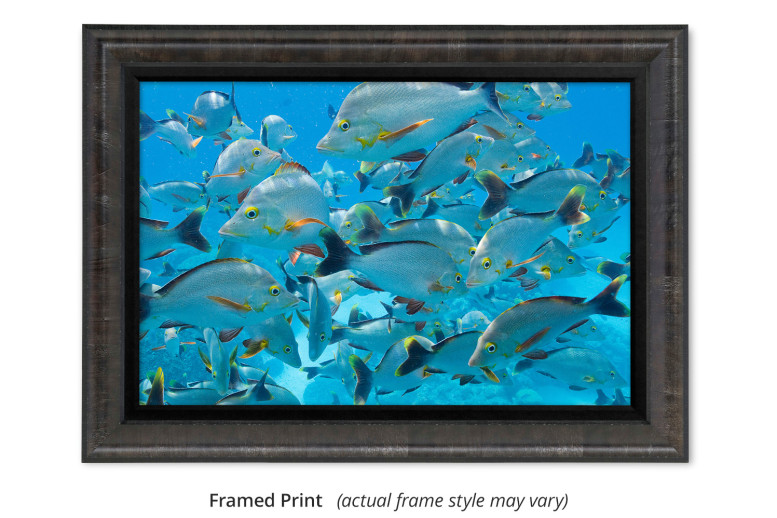
The width and height of the screenshot is (777, 518). Identify the location of painting. (375, 143).